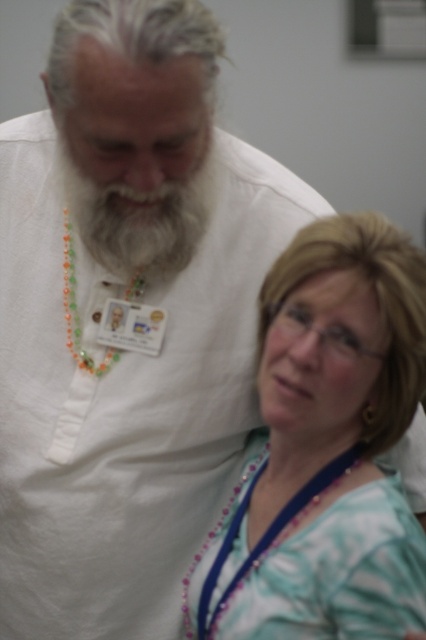
Question: Which point is farther to the camera?

Choices:
 (A) graywool-likebeard at center
 (B) purple beaded necklace at center
 (C) teal striped shirt at lower right

Answer: (A)

Question: Can you confirm if graywool-likebeard at center is positioned below purple beaded necklace at center?

Choices:
 (A) no
 (B) yes

Answer: (A)

Question: Among these points, which one is nearest to the camera?

Choices:
 (A) (342, 360)
 (B) (302, 493)
 (C) (132, 253)

Answer: (A)

Question: Which point is farther from the camera taking this photo?

Choices:
 (A) (313, 492)
 (B) (321, 296)

Answer: (A)

Question: Is graywool-likebeard at center to the right of purple beaded necklace at center from the viewer's perspective?

Choices:
 (A) yes
 (B) no

Answer: (B)

Question: Is teal striped shirt at lower right above purple beaded necklace at center?

Choices:
 (A) no
 (B) yes

Answer: (B)